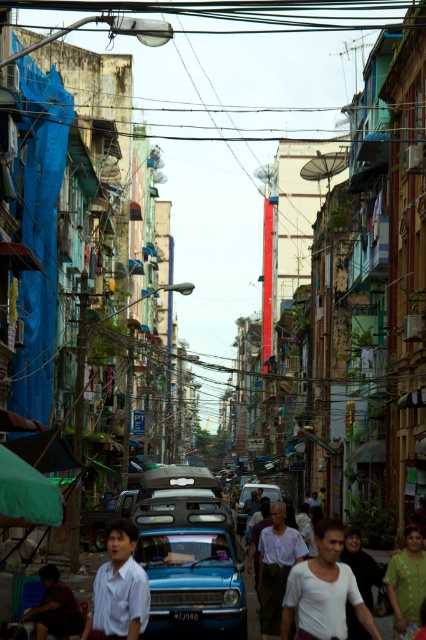
A person is standing at the point marked by the coordinate point at (221, 586). They want to walk to the blue car in the foreground. How far will they have to walk?

The person will have to walk 37.93 meters to reach the blue car in the foreground from the point at (221, 586).